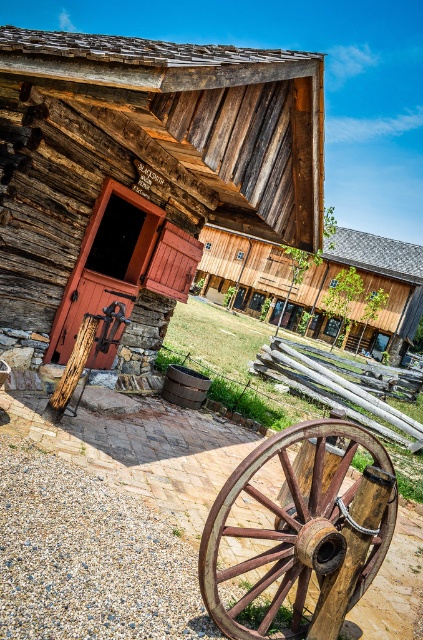
Question: Is rustic wood wagon wheel at center closer to camera compared to wooden barn at center?

Choices:
 (A) yes
 (B) no

Answer: (A)

Question: Which object is positioned farthest from the rustic wood barn at center?

Choices:
 (A) wooden barn at center
 (B) rustic wood wagon wheel at center

Answer: (A)

Question: Which point appears farthest from the camera in this image?

Choices:
 (A) (261, 282)
 (B) (340, 548)

Answer: (A)

Question: Which point is closer to the camera?

Choices:
 (A) rustic wood wagon wheel at center
 (B) rustic wood barn at center
 (C) wooden barn at center

Answer: (A)

Question: Where is rustic wood wagon wheel at center located in relation to wooden barn at center in the image?

Choices:
 (A) above
 (B) below

Answer: (B)

Question: Can you confirm if rustic wood barn at center is bigger than rustic wood wagon wheel at center?

Choices:
 (A) yes
 (B) no

Answer: (A)